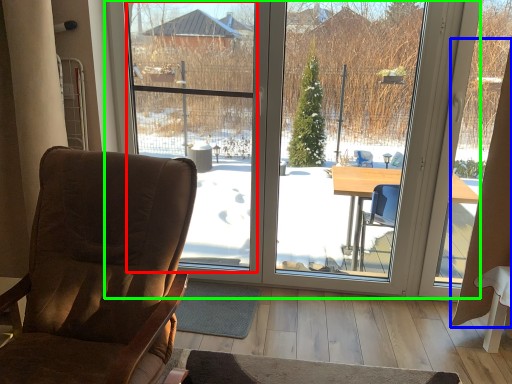
Question: Which object is positioned closest to window screen (highlighted by a red box)? Select from curtain (highlighted by a blue box) and window (highlighted by a green box).

Choices:
 (A) curtain
 (B) window

Answer: (B)